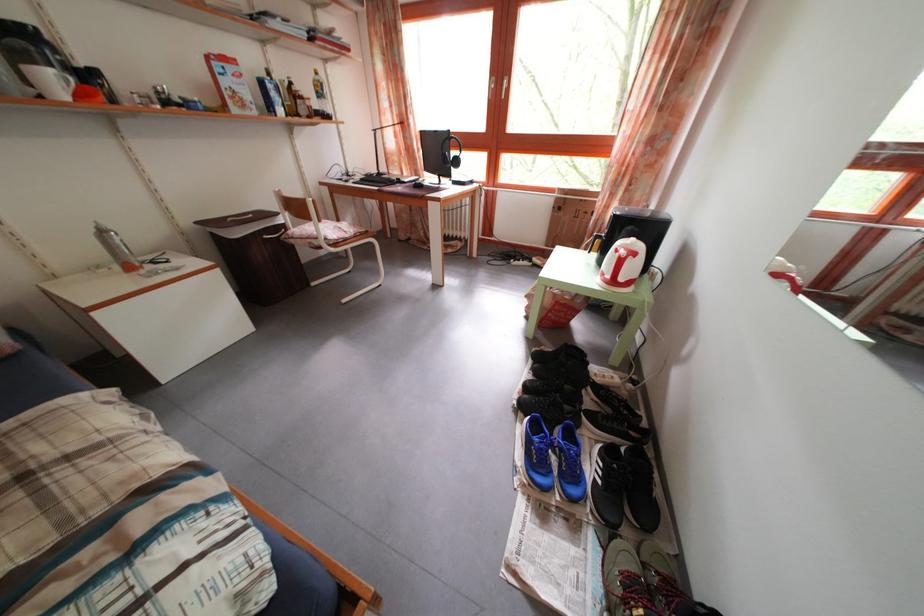
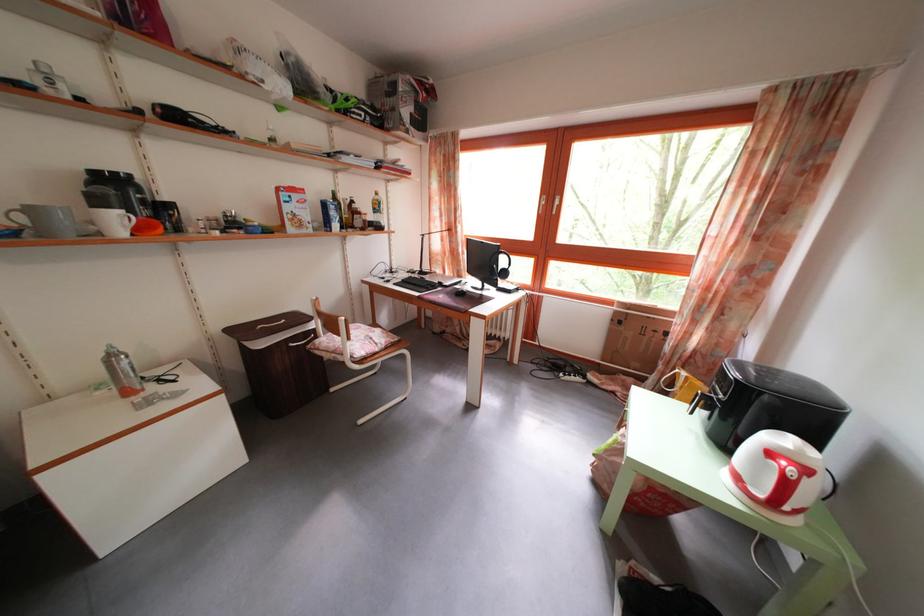
The point at (411, 190) is marked in the first image. Where is the corresponding point in the second image?

(454, 294)